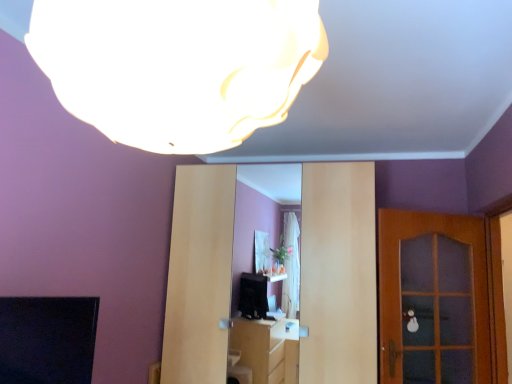
Question: From a real-world perspective, is white matte lampshade at upper center above or below matte wood entertainment center at center?

Choices:
 (A) above
 (B) below

Answer: (A)

Question: Based on their positions, is white matte lampshade at upper center located to the left or right of matte wood entertainment center at center?

Choices:
 (A) right
 (B) left

Answer: (B)

Question: Estimate the real-world distances between objects in this image. Which object is farther from the white matte lampshade at upper center?

Choices:
 (A) wooden door at right
 (B) matte wood entertainment center at center

Answer: (A)

Question: Which of these objects is positioned farthest from the matte wood entertainment center at center?

Choices:
 (A) white matte lampshade at upper center
 (B) wooden door at right

Answer: (A)